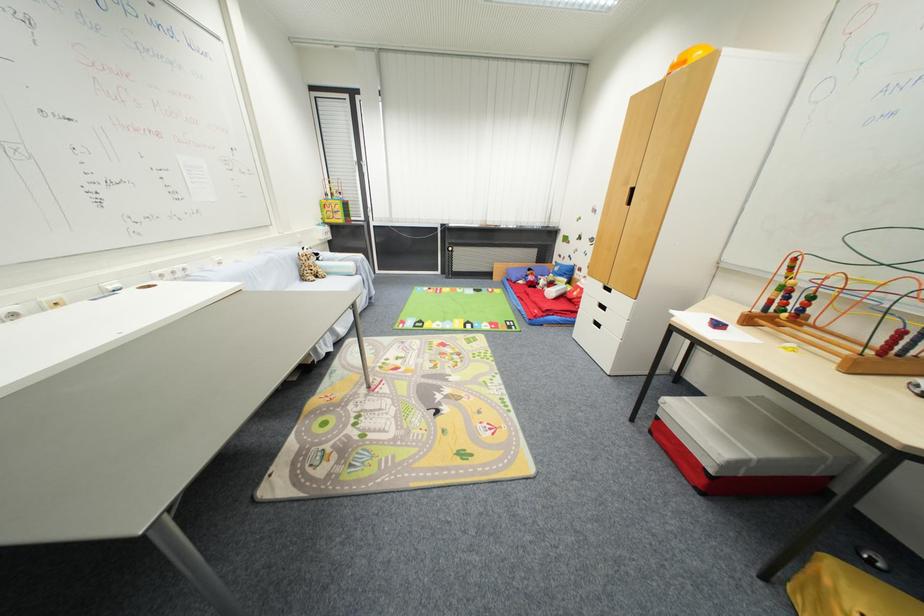
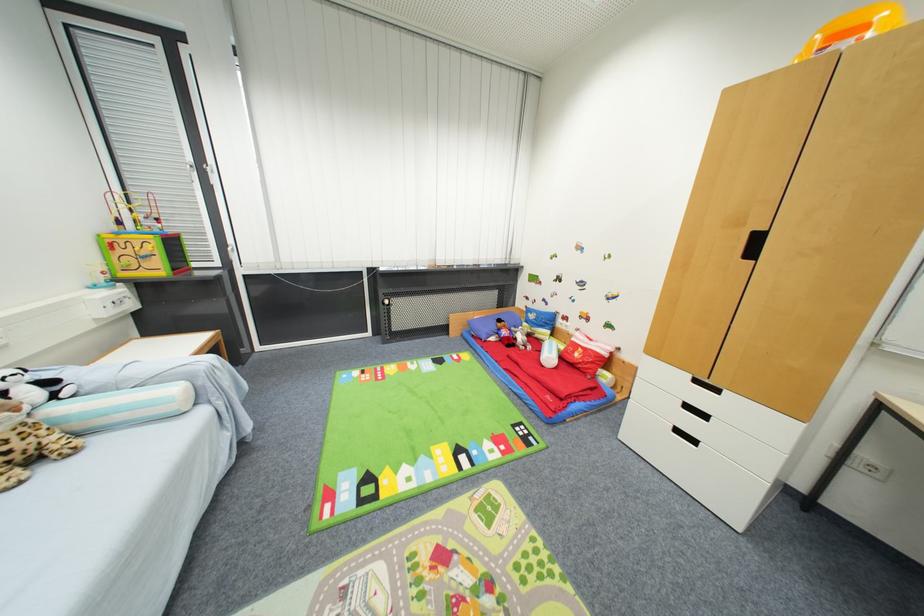
Where in the second image is the point corresponding to pixel 518 282 from the first image?

(488, 339)